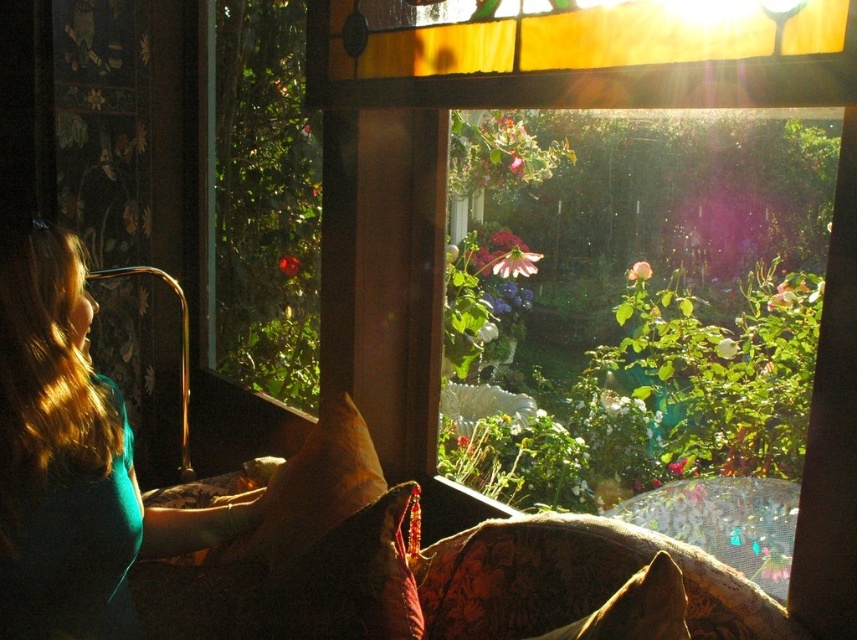
You are an interior designer assessing the space for a new rug. The velvet floral couch at lower center is your focal point. Considering the size of the teal fabric shirt at left, which object would require a larger rug to accommodate its placement?

The velvet floral couch at lower center requires a larger rug because it is bigger than the teal fabric shirt at left.

You are standing in the room and want to locate the teal fabric shirt at left. According to the coordinates provided, where would you look to find it?

The teal fabric shirt at left is located at the coordinates point (72, 460).